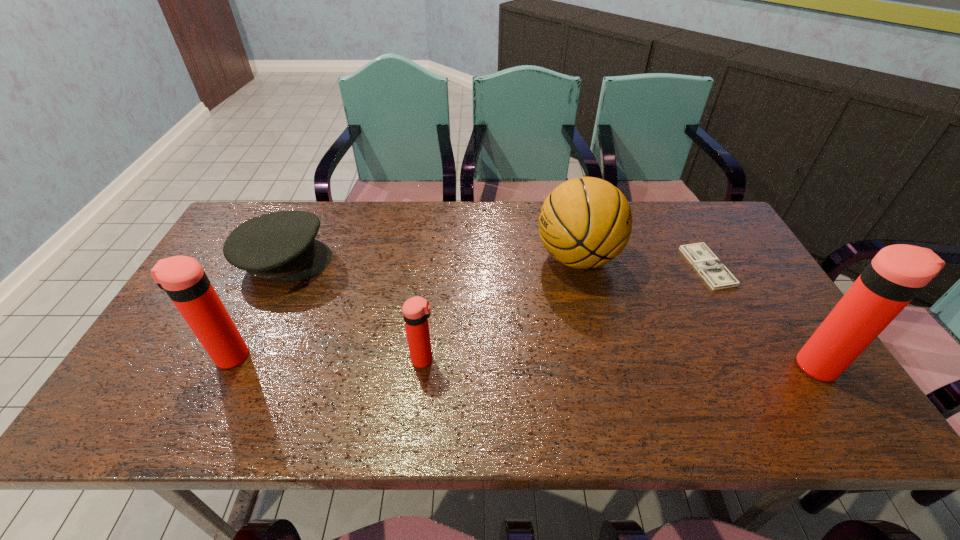
The image size is (960, 540). I want to click on the second tallest thermos bottle, so click(182, 277).

Identify the location of the second thermos bottle from left to right. This screenshot has width=960, height=540. pyautogui.click(x=416, y=310).

Identify the location of the third shortest object. The image size is (960, 540). (416, 310).

This screenshot has width=960, height=540. Find the location of `the rightmost object`. the rightmost object is located at coordinates (895, 276).

You are a GUI agent. You are given a task and a screenshot of the screen. Output one action in this format:
    pyautogui.click(x=<x>, y=<y>)
    Task: Click on the basketball
    This screenshot has width=960, height=540.
    Given the screenshot: What is the action you would take?
    pyautogui.click(x=587, y=222)

Where is `the fourth shortest object`? The height and width of the screenshot is (540, 960). the fourth shortest object is located at coordinates (587, 222).

Where is `the fifth tallest object`? The height and width of the screenshot is (540, 960). the fifth tallest object is located at coordinates (281, 246).

I want to click on dollar, so click(x=713, y=271).

Where is `the second object from right to left`? the second object from right to left is located at coordinates (713, 271).

Locate an element on the screen. This screenshot has width=960, height=540. free region located 0.400m on the back of the leftmost thermos bottle is located at coordinates (287, 241).